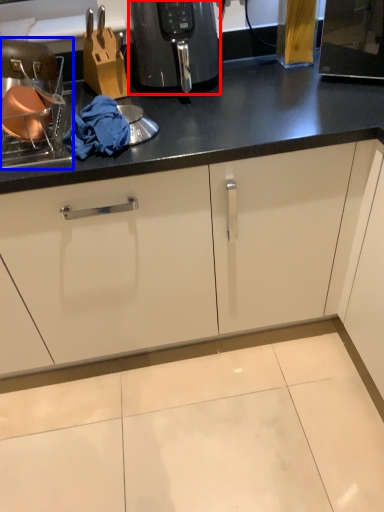
Question: Which of the following is the farthest to the observer, home appliance (highlighted by a red box) or appliance (highlighted by a blue box)?

Choices:
 (A) home appliance
 (B) appliance

Answer: (A)